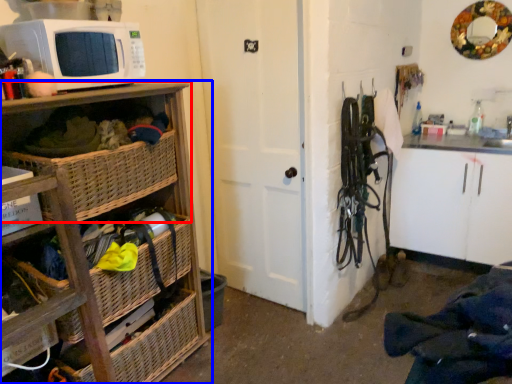
Question: Among these objects, which one is farthest to the camera, shelf (highlighted by a red box) or cabinetry (highlighted by a blue box)?

Choices:
 (A) shelf
 (B) cabinetry

Answer: (A)